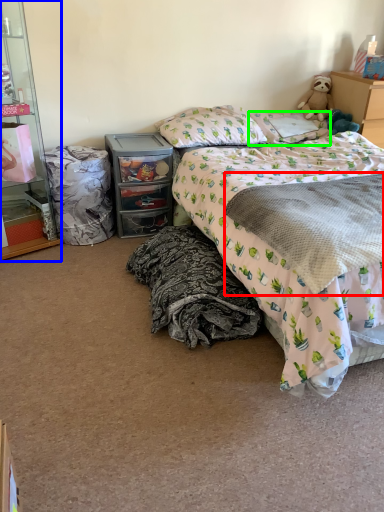
Question: Based on their relative distances, which object is nearer to blanket (highlighted by a red box)? Choose from cabinetry (highlighted by a blue box) and pillow (highlighted by a green box).

Choices:
 (A) cabinetry
 (B) pillow

Answer: (B)